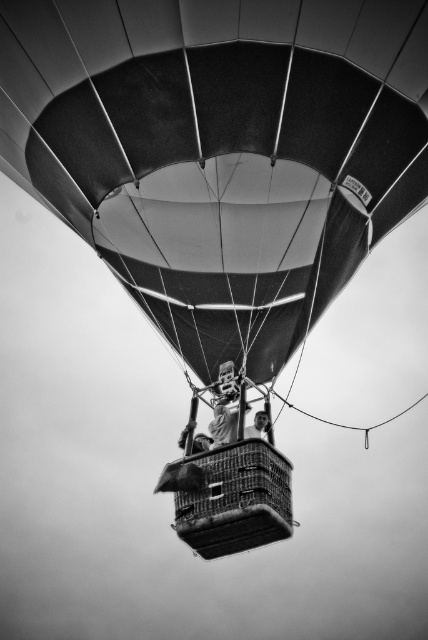
Is matte black balloon at center to the right of metallic wire basket at center from the viewer's perspective?

No, matte black balloon at center is not to the right of metallic wire basket at center.

Consider the image. Is matte black balloon at center to the left of metallic wire basket at center from the viewer's perspective?

Indeed, matte black balloon at center is positioned on the left side of metallic wire basket at center.

Does point (171, 179) come behind point (237, 532)?

Yes.

I want to click on matte black balloon at center, so click(x=220, y=150).

Which is more to the right, metallic wire basket at center or smooth skin face at center?

Positioned to the right is smooth skin face at center.

Does metallic wire basket at center have a larger size compared to smooth skin face at center?

Yes, metallic wire basket at center is bigger than smooth skin face at center.

Is point (237, 504) closer to camera compared to point (255, 420)?

Yes, it is.

Locate an element on the screen. Image resolution: width=428 pixels, height=640 pixels. metallic wire basket at center is located at coordinates (237, 499).

Can you confirm if smooth stone statue at center is thinner than smooth skin face at center?

In fact, smooth stone statue at center might be wider than smooth skin face at center.

Is point (228, 436) behind point (267, 413)?

No.

The image size is (428, 640). Find the location of `smooth stone statue at center`. smooth stone statue at center is located at coordinates (223, 420).